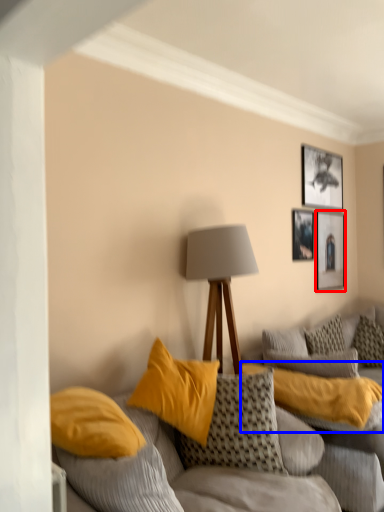
Question: Which object is further to the camera taking this photo, picture frame (highlighted by a red box) or pillow (highlighted by a blue box)?

Choices:
 (A) picture frame
 (B) pillow

Answer: (A)